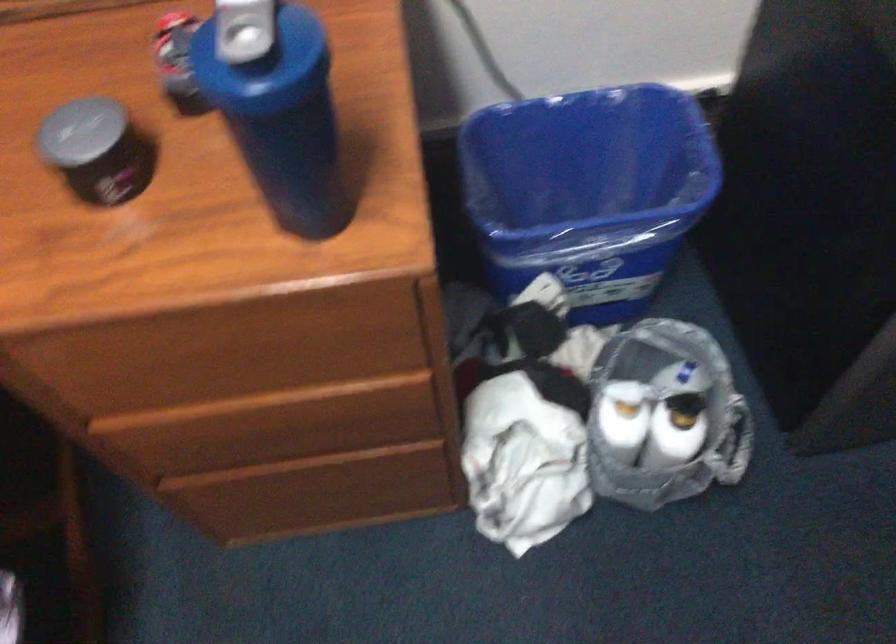
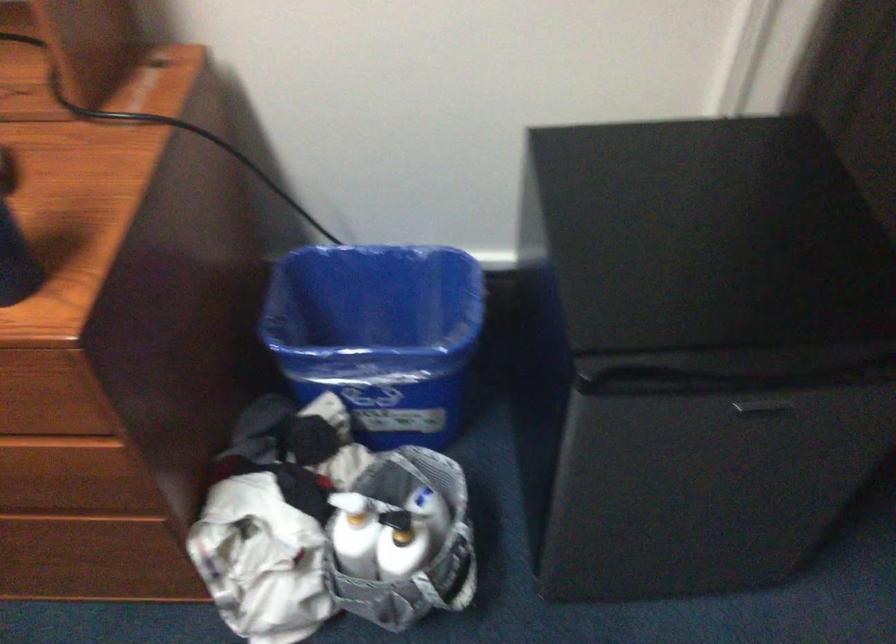
Locate, in the second image, the point that corresponds to (x=544, y=182) in the first image.

(367, 317)